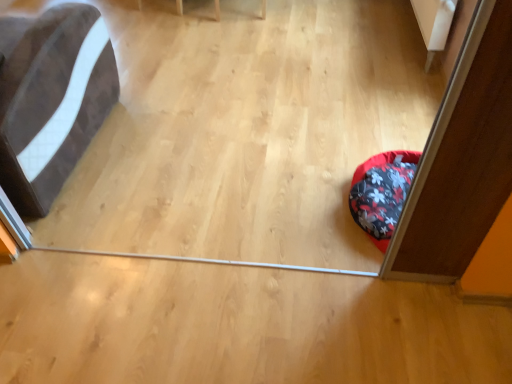
The width and height of the screenshot is (512, 384). Find the location of `vacant space to the right of matte brown sofa at left`. vacant space to the right of matte brown sofa at left is located at coordinates (181, 144).